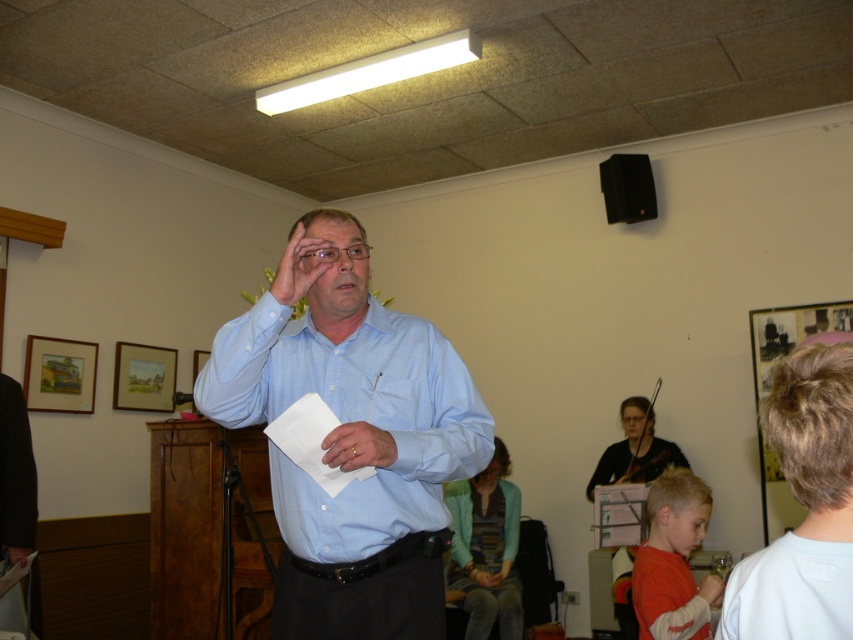
Does light blue shirt at center appear over orange cotton shirt at lower right?

Indeed, light blue shirt at center is positioned over orange cotton shirt at lower right.

Between light blue shirt at center and orange cotton shirt at lower right, which one is positioned higher?

light blue shirt at center

Where is `light blue shirt at center`? The height and width of the screenshot is (640, 853). light blue shirt at center is located at coordinates (351, 420).

Where is `light blue shirt at center`? The height and width of the screenshot is (640, 853). light blue shirt at center is located at coordinates (351, 420).

Is the position of white matte dress shirt at right less distant than that of gold metallic ring at center?

Yes.

Where is `white matte dress shirt at right`? This screenshot has width=853, height=640. white matte dress shirt at right is located at coordinates (805, 508).

Find the location of a particular element. white matte dress shirt at right is located at coordinates (805, 508).

Who is shorter, white matte dress shirt at right or orange cotton shirt at lower right?

With less height is white matte dress shirt at right.

Does point (811, 561) come behind point (656, 477)?

No.

Find the location of `white matte dress shirt at right`. white matte dress shirt at right is located at coordinates point(805,508).